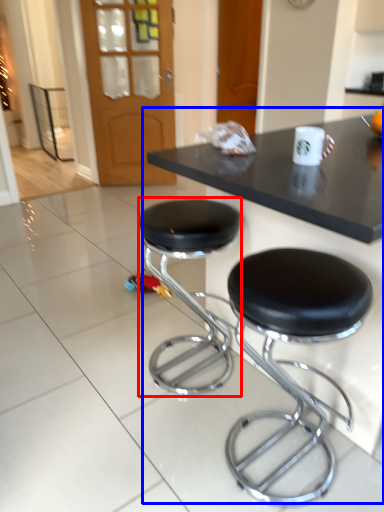
Question: Among these objects, which one is farthest to the camera, stool (highlighted by a red box) or table (highlighted by a blue box)?

Choices:
 (A) stool
 (B) table

Answer: (A)